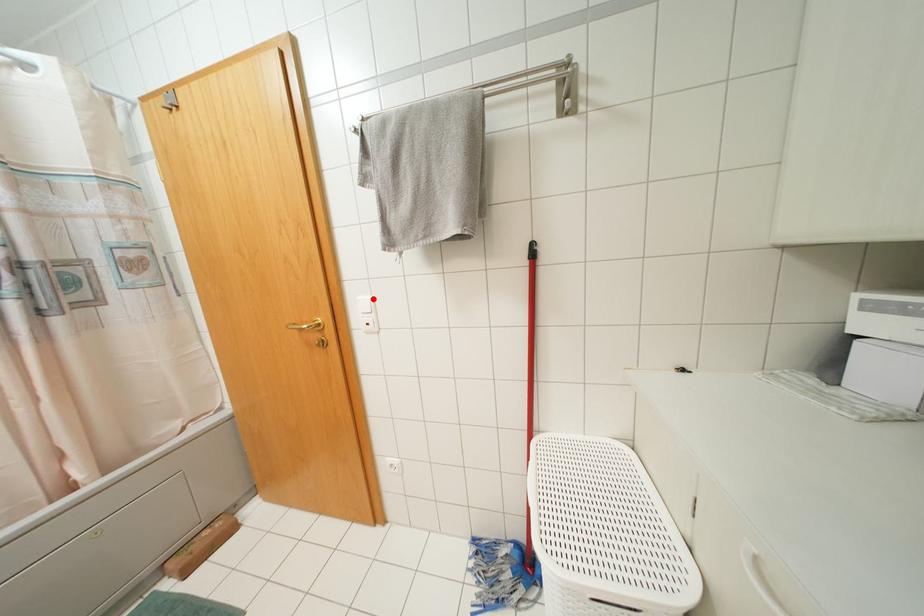
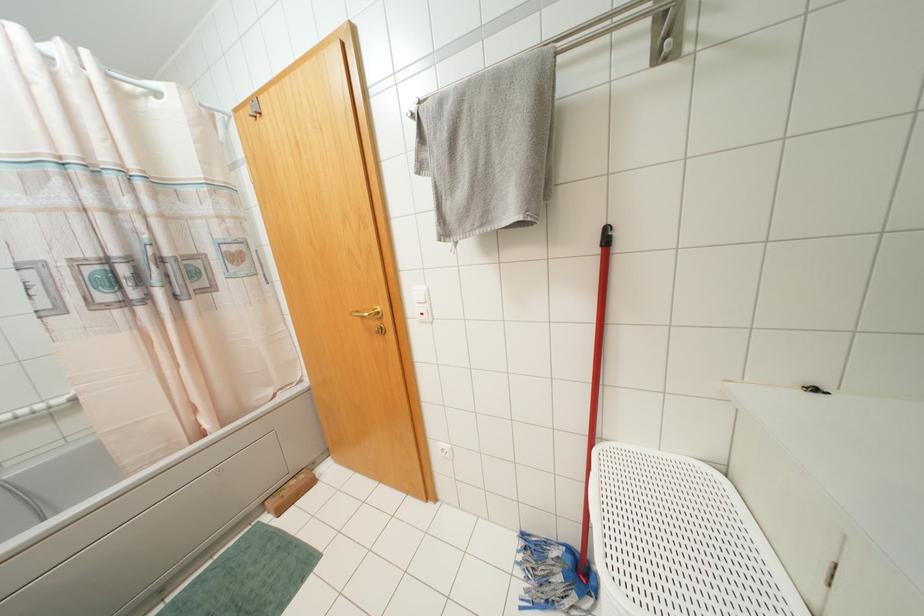
In the second image, find the point that corresponds to the highlighted location in the first image.

(428, 290)